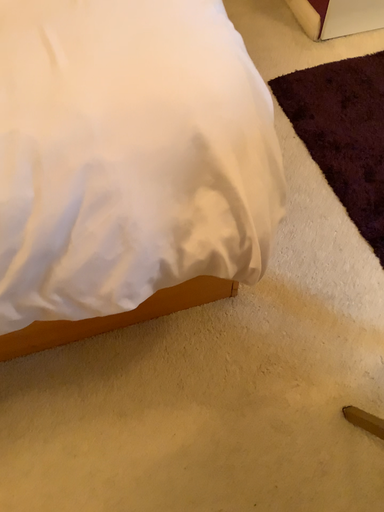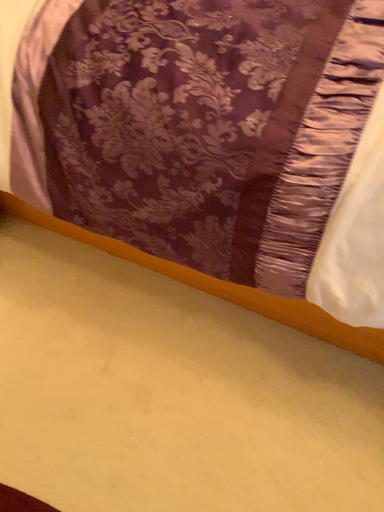
Question: Which way did the camera rotate in the video?

Choices:
 (A) rotated left
 (B) rotated right

Answer: (A)